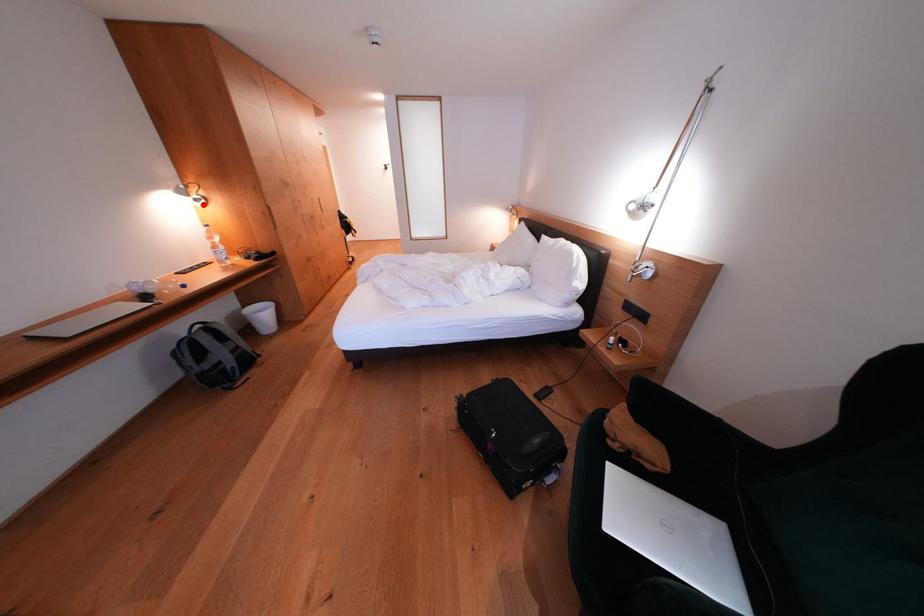
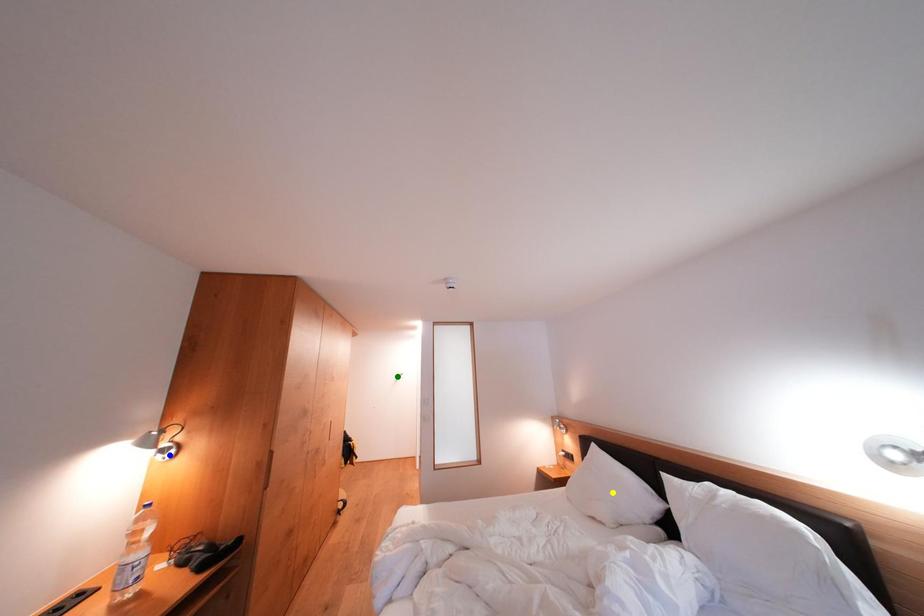
Question: I am providing you with two images of the same scene from different viewpoints. A red point is marked on the first image. You are given multiple points on the second image. In image 2, which mark is for the same physical point as the one in image 1?

Choices:
 (A) green point
 (B) yellow point
 (C) blue point

Answer: (C)